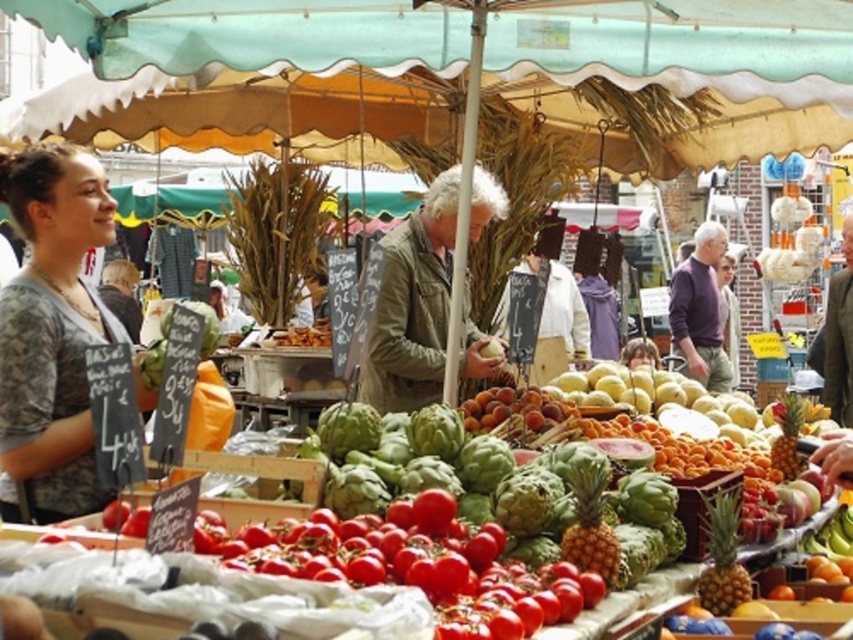
Describe the element at coordinates (51, 330) in the screenshot. The width and height of the screenshot is (853, 640). I see `camouflage shirt at center` at that location.

In the scene shown: Who is higher up, camouflage shirt at center or khaki textured jacket at center?

Positioned higher is camouflage shirt at center.

Identify the location of camouflage shirt at center. (51, 330).